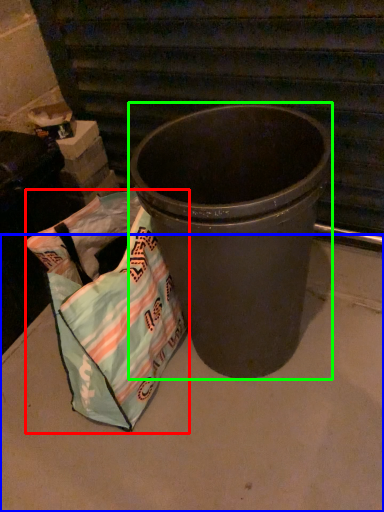
Question: Which object is the closest to the grocery bag (highlighted by a red box)? Choose among these: concrete (highlighted by a blue box) or waste container (highlighted by a green box).

Choices:
 (A) concrete
 (B) waste container

Answer: (B)